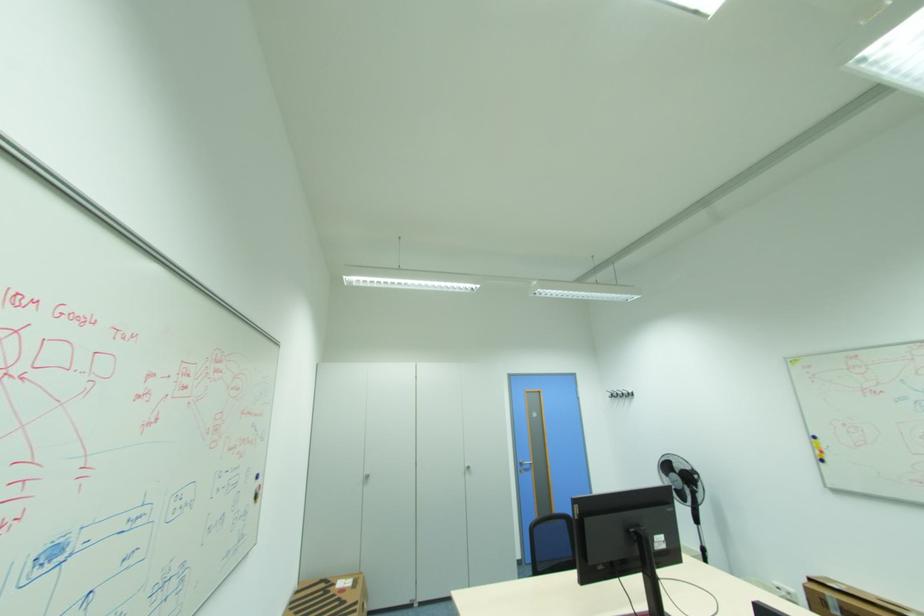
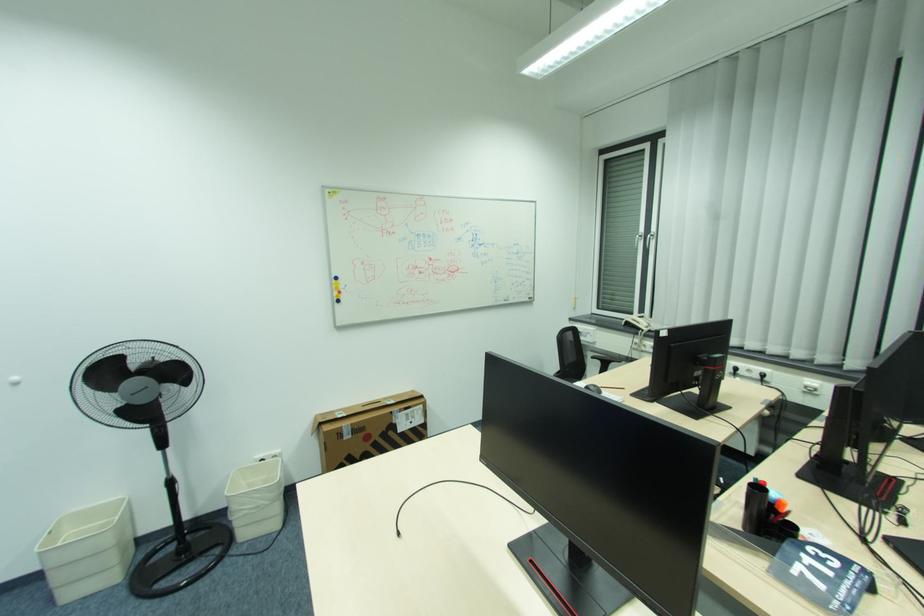
Find the pixel in the second image that matches (x=819, y=440) in the first image.

(339, 282)